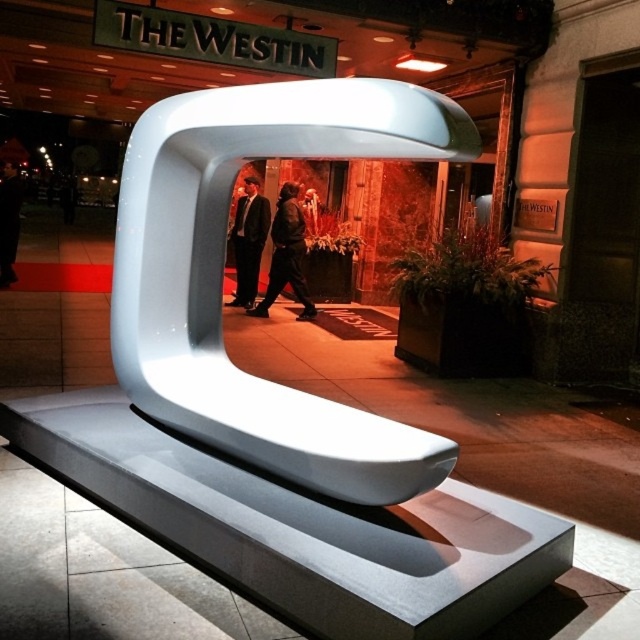
Question: Which point is closer to the camera taking this photo?

Choices:
 (A) (272, 154)
 (B) (13, 276)

Answer: (A)

Question: Is white glossy bench at center closer to camera compared to dark brown leather jacket at center?

Choices:
 (A) no
 (B) yes

Answer: (B)

Question: Can you confirm if white glossy bench at center is bigger than dark brown leather jacket at center?

Choices:
 (A) yes
 (B) no

Answer: (A)

Question: Considering the real-world distances, which object is farthest from the white glossy bench at center?

Choices:
 (A) black leather jacket at left
 (B) dark brown leather jacket at center

Answer: (A)

Question: Among these objects, which one is nearest to the camera?

Choices:
 (A) black leather jacket at left
 (B) white glossy bench at center
 (C) dark brown leather jacket at center

Answer: (B)

Question: Is the position of dark brown leather jacket at center less distant than that of black leather jacket at left?

Choices:
 (A) no
 (B) yes

Answer: (B)